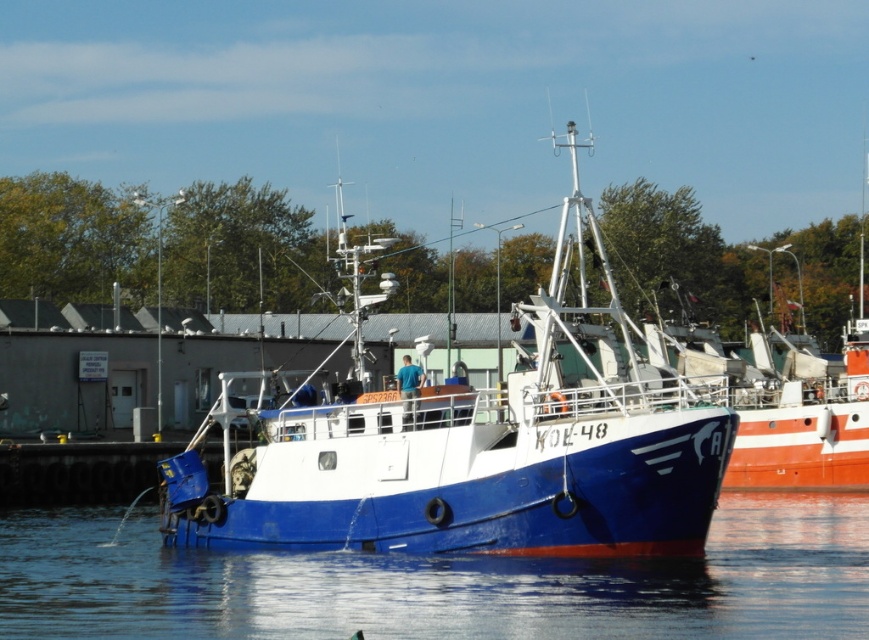
Which is above, blue matte boat at center or blue water at lower center?

blue matte boat at center is above.

Between blue matte boat at center and blue water at lower center, which one is positioned lower?

blue water at lower center is below.

Who is more forward, (357,374) or (641,593)?

Point (641,593) is more forward.

Locate an element on the screen. The height and width of the screenshot is (640, 869). blue matte boat at center is located at coordinates (483, 451).